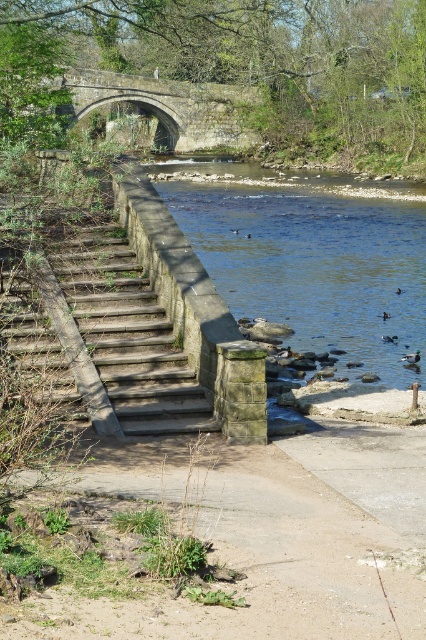
Looking at this image, you are standing at the base of the stone staircase looking towards the river. There are two points marked in the scene. Which point, point (181, 458) or point (388, 316), is closer to you?

Point (181, 458) is closer to you than point (388, 316).

You are standing at the riverside and see two points marked on the image. Which point is closer to you, point (336, 179) or point (57, 106)?

Point (336, 179) is further to the viewer than point (57, 106), so point (57, 106) is closer to you.